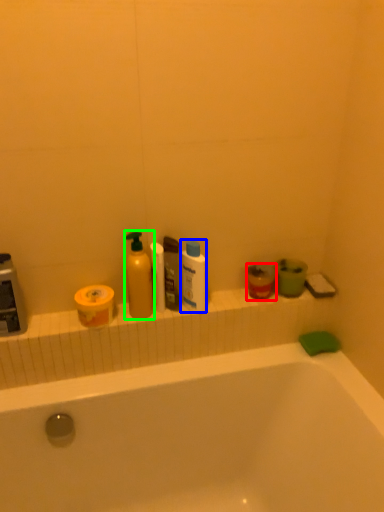
Question: Which object is positioned closest to mouthwash (highlighted by a red box)? Select from cleaning product (highlighted by a blue box) and cleaning product (highlighted by a green box).

Choices:
 (A) cleaning product
 (B) cleaning product

Answer: (A)